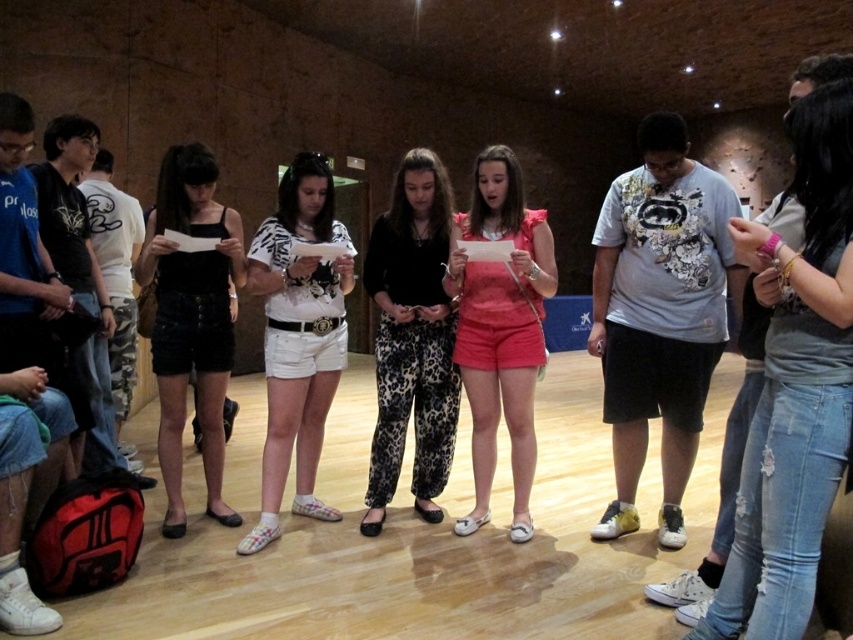
Question: Which point is farther to the camera?

Choices:
 (A) (310, 504)
 (B) (526, 260)

Answer: (A)

Question: Can you confirm if black leopard print pants at center is smaller than matte pink shorts at center?

Choices:
 (A) yes
 (B) no

Answer: (A)

Question: Can you confirm if black leopard print pants at center is bigger than black denim shorts at center?

Choices:
 (A) yes
 (B) no

Answer: (B)

Question: Which object appears closest to the camera in this image?

Choices:
 (A) black leopard print pants at center
 (B) white cotton shorts at center
 (C) matte pink shorts at center
 (D) black denim shorts at center

Answer: (B)

Question: Does white cotton shorts at center appear on the right side of black denim shorts at center?

Choices:
 (A) no
 (B) yes

Answer: (B)

Question: Which object appears closest to the camera in this image?

Choices:
 (A) white cotton shorts at center
 (B) black denim shorts at center
 (C) matte pink shorts at center

Answer: (A)